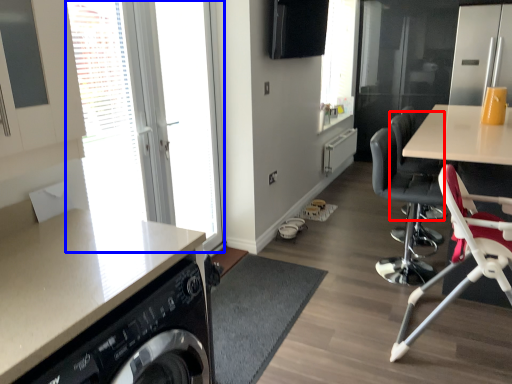
Question: Which object appears closest to the camera in this image, armchair (highlighted by a red box) or window (highlighted by a blue box)?

Choices:
 (A) armchair
 (B) window

Answer: (B)